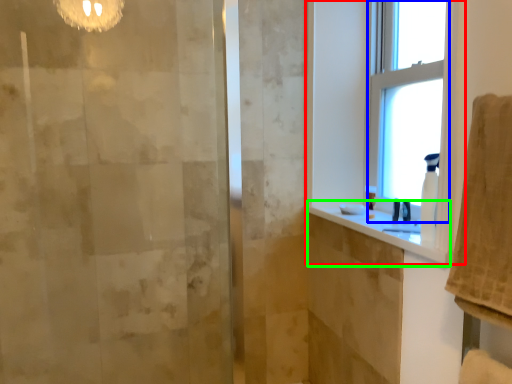
Question: Which object is positioned closest to window (highlighted by a red box)? Select from window (highlighted by a blue box) and counter top (highlighted by a green box).

Choices:
 (A) window
 (B) counter top

Answer: (A)